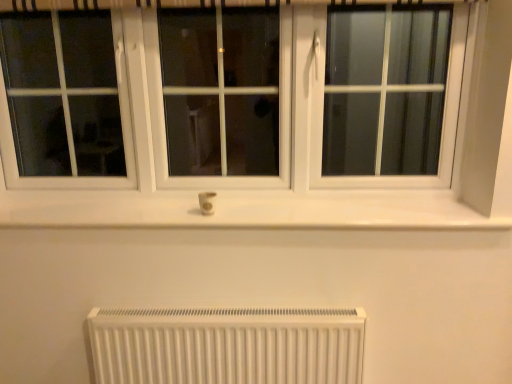
The height and width of the screenshot is (384, 512). Find the location of `white plastic electric outlet at center`. white plastic electric outlet at center is located at coordinates (207, 202).

Measure the distance between white plastic electric outlet at center and camera.

They are 1.41 meters apart.

Describe the element at coordinates (207, 202) in the screenshot. This screenshot has width=512, height=384. I see `white plastic electric outlet at center` at that location.

The height and width of the screenshot is (384, 512). Identify the location of white matte radiator at lower center. (227, 345).

This screenshot has height=384, width=512. Describe the element at coordinates (227, 345) in the screenshot. I see `white matte radiator at lower center` at that location.

At what (x,y) coordinates should I click in order to perform the action: click on white plastic electric outlet at center. Please return your answer as a coordinate pair (x, y). Looking at the image, I should click on (207, 202).

Considering the relative positions of white matte radiator at lower center and white plastic electric outlet at center in the image provided, is white matte radiator at lower center to the left or to the right of white plastic electric outlet at center?

From the image, it's evident that white matte radiator at lower center is to the right of white plastic electric outlet at center.

Between white matte radiator at lower center and white plastic electric outlet at center, which one is positioned in front?

white matte radiator at lower center is in front.

Does point (331, 321) lie behind point (205, 201)?

No.

From the image's perspective, which one is positioned higher, white matte radiator at lower center or white plastic electric outlet at center?

white plastic electric outlet at center appears higher in the image.

From a real-world perspective, is white matte radiator at lower center below white plastic electric outlet at center?

Yes, from a real-world perspective, white matte radiator at lower center is beneath white plastic electric outlet at center.

Does white matte radiator at lower center have a greater width compared to white plastic electric outlet at center?

Yes.

Considering the relative sizes of white matte radiator at lower center and white plastic electric outlet at center in the image provided, is white matte radiator at lower center shorter than white plastic electric outlet at center?

No, white matte radiator at lower center is not shorter than white plastic electric outlet at center.

Which of these two, white matte radiator at lower center or white plastic electric outlet at center, is bigger?

white matte radiator at lower center is bigger.

Would you say white matte radiator at lower center contains white plastic electric outlet at center?

No, white plastic electric outlet at center is not inside white matte radiator at lower center.

Are white matte radiator at lower center and white plastic electric outlet at center far apart?

white matte radiator at lower center is near white plastic electric outlet at center, not far away.

Could you tell me if white matte radiator at lower center is facing white plastic electric outlet at center?

No, white matte radiator at lower center is not oriented towards white plastic electric outlet at center.

How different are the orientations of white matte radiator at lower center and white plastic electric outlet at center in degrees?

0.00105 degrees.

This screenshot has width=512, height=384. Find the location of `electric outlet behind the white matte radiator at lower center`. electric outlet behind the white matte radiator at lower center is located at coordinates coord(207,202).

Based on their positions, is white plastic electric outlet at center located to the left or right of white matte radiator at lower center?

white plastic electric outlet at center is to the left of white matte radiator at lower center.

Is white plastic electric outlet at center in front of or behind white matte radiator at lower center in the image?

Visually, white plastic electric outlet at center is located behind white matte radiator at lower center.

Is point (199, 203) more distant than point (220, 328)?

Yes, it is.

From the image's perspective, is white plastic electric outlet at center on white matte radiator at lower center?

Indeed, from the image's perspective, white plastic electric outlet at center is shown above white matte radiator at lower center.

Based on the photo, from a real-world perspective, does white plastic electric outlet at center sit lower than white matte radiator at lower center?

Actually, white plastic electric outlet at center is physically above white matte radiator at lower center in the real world.

Does white plastic electric outlet at center have a lesser width compared to white matte radiator at lower center?

Yes.

Considering the sizes of objects white plastic electric outlet at center and white matte radiator at lower center in the image provided, who is shorter, white plastic electric outlet at center or white matte radiator at lower center?

Standing shorter between the two is white plastic electric outlet at center.

Considering the relative sizes of white plastic electric outlet at center and white matte radiator at lower center in the image provided, is white plastic electric outlet at center bigger than white matte radiator at lower center?

Actually, white plastic electric outlet at center might be smaller than white matte radiator at lower center.

Would you say white plastic electric outlet at center is outside white matte radiator at lower center?

Indeed, white plastic electric outlet at center is completely outside white matte radiator at lower center.

Is white plastic electric outlet at center far away from white matte radiator at lower center?

That's not correct — white plastic electric outlet at center is a little close to white matte radiator at lower center.

Is white plastic electric outlet at center facing towards white matte radiator at lower center?

No, white plastic electric outlet at center does not turn towards white matte radiator at lower center.

What's the angular difference between white plastic electric outlet at center and white matte radiator at lower center's facing directions?

The angular difference between white plastic electric outlet at center and white matte radiator at lower center is 0.00105 degrees.

The image size is (512, 384). In order to click on radiator below the white plastic electric outlet at center (from a real-world perspective) in this screenshot , I will do `click(227, 345)`.

The image size is (512, 384). In order to click on radiator located in front of the white plastic electric outlet at center in this screenshot , I will do [x=227, y=345].

The width and height of the screenshot is (512, 384). What are the coordinates of `radiator that is below the white plastic electric outlet at center (from the image's perspective)` in the screenshot? It's located at (227, 345).